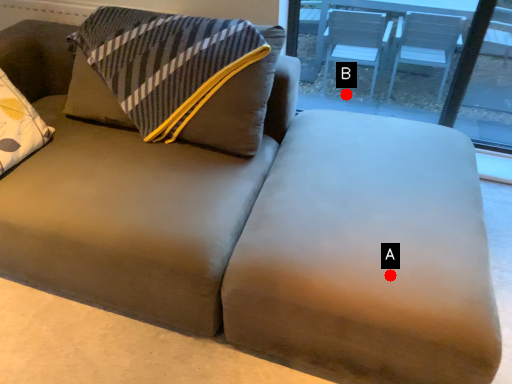
Question: Two points are circled on the image, labeled by A and B beside each circle. Which point is closer to the camera?

Choices:
 (A) A is closer
 (B) B is closer

Answer: (A)